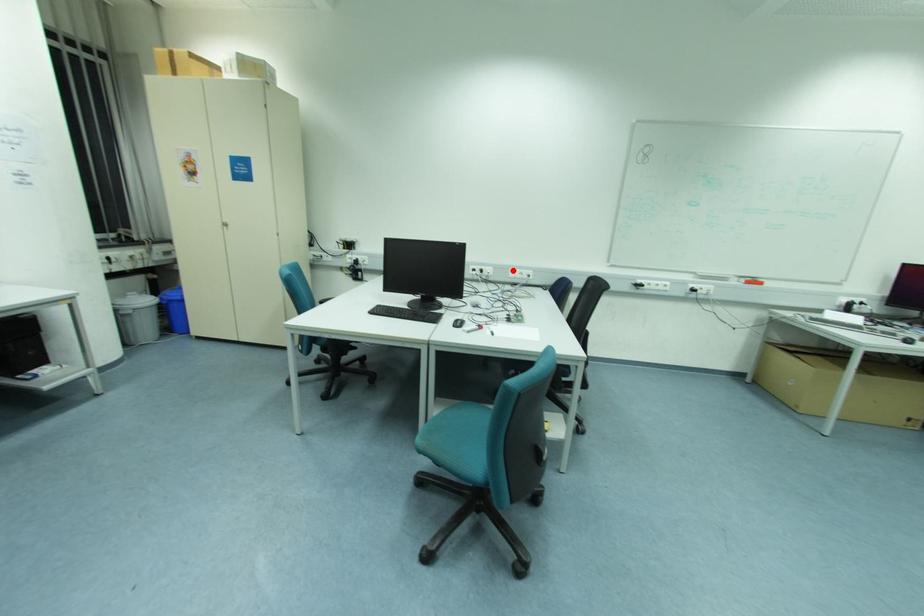
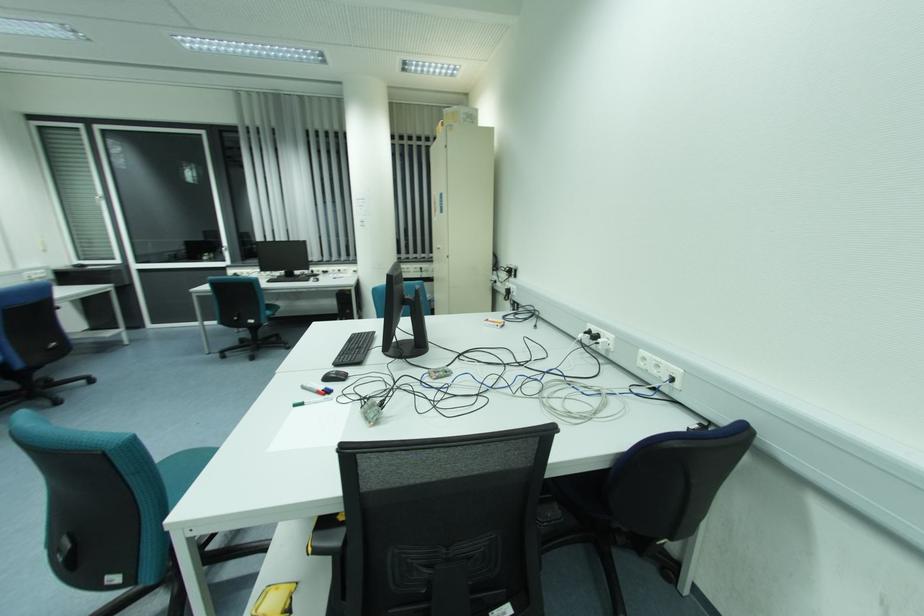
Where in the second image is the point corresponding to the highlighted location from the first image?

(642, 352)